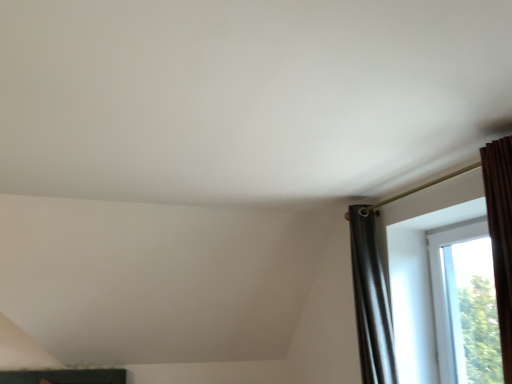
Image resolution: width=512 pixels, height=384 pixels. What do you see at coordinates (423, 269) in the screenshot?
I see `transparent glass window at right, which ranks as the 2th window in right-to-left order` at bounding box center [423, 269].

In order to face transparent glass window at right, which ranks as the 2th window in right-to-left order, should I rotate leftwards or rightwards?

To face it directly, rotate right by 22.806 degrees.

Where is `transparent glass window at right, which appears as the 1th window when viewed from the left`? transparent glass window at right, which appears as the 1th window when viewed from the left is located at coordinates (423, 269).

Measure the distance between transparent glass window at right, the 2th window in the left-to-right sequence, and camera.

transparent glass window at right, the 2th window in the left-to-right sequence, and camera are 8.05 feet apart from each other.

The image size is (512, 384). What do you see at coordinates (465, 304) in the screenshot?
I see `transparent glass window at right, the 2th window in the left-to-right sequence` at bounding box center [465, 304].

Locate an element on the screen. transparent glass window at right, the 2th window in the left-to-right sequence is located at coordinates (465, 304).

Where is `transparent glass window at right, which ranks as the 2th window in right-to-left order`? This screenshot has height=384, width=512. transparent glass window at right, which ranks as the 2th window in right-to-left order is located at coordinates (423, 269).

Does transparent glass window at right, the 2th window in the left-to-right sequence, appear on the left side of transparent glass window at right, which appears as the 1th window when viewed from the left?

Incorrect, transparent glass window at right, the 2th window in the left-to-right sequence, is not on the left side of transparent glass window at right, which appears as the 1th window when viewed from the left.

Is transparent glass window at right, the 1th window when ordered from right to left, further to the viewer compared to transparent glass window at right, which ranks as the 2th window in right-to-left order?

Yes, transparent glass window at right, the 1th window when ordered from right to left, is behind transparent glass window at right, which ranks as the 2th window in right-to-left order.

Between point (463, 380) and point (437, 346), which one is positioned behind?

The point (437, 346) is more distant.

From the image's perspective, is transparent glass window at right, the 2th window in the left-to-right sequence, on transparent glass window at right, which ranks as the 2th window in right-to-left order?

Actually, transparent glass window at right, the 2th window in the left-to-right sequence, appears below transparent glass window at right, which ranks as the 2th window in right-to-left order, in the image.

From a real-world perspective, is transparent glass window at right, the 2th window in the left-to-right sequence, beneath transparent glass window at right, which ranks as the 2th window in right-to-left order?

Yes.

Which object is thinner, transparent glass window at right, the 1th window when ordered from right to left, or transparent glass window at right, which appears as the 1th window when viewed from the left?

transparent glass window at right, which appears as the 1th window when viewed from the left, is thinner.

Does transparent glass window at right, the 2th window in the left-to-right sequence, have a lesser height compared to transparent glass window at right, which appears as the 1th window when viewed from the left?

Yes, transparent glass window at right, the 2th window in the left-to-right sequence, is shorter than transparent glass window at right, which appears as the 1th window when viewed from the left.

In terms of size, does transparent glass window at right, the 2th window in the left-to-right sequence, appear bigger or smaller than transparent glass window at right, which appears as the 1th window when viewed from the left?

Considering their sizes, transparent glass window at right, the 2th window in the left-to-right sequence, takes up less space than transparent glass window at right, which appears as the 1th window when viewed from the left.

In the scene shown: Is transparent glass window at right, the 2th window in the left-to-right sequence, not within transparent glass window at right, which ranks as the 2th window in right-to-left order?

Yes, transparent glass window at right, the 2th window in the left-to-right sequence, is outside of transparent glass window at right, which ranks as the 2th window in right-to-left order.

Based on the photo, would you consider transparent glass window at right, the 1th window when ordered from right to left, to be distant from transparent glass window at right, which ranks as the 2th window in right-to-left order?

Actually, transparent glass window at right, the 1th window when ordered from right to left, and transparent glass window at right, which ranks as the 2th window in right-to-left order, are a little close together.

Is transparent glass window at right, the 1th window when ordered from right to left, oriented away from transparent glass window at right, which appears as the 1th window when viewed from the left?

That's right, transparent glass window at right, the 1th window when ordered from right to left, is facing away from transparent glass window at right, which appears as the 1th window when viewed from the left.

What's the angular difference between transparent glass window at right, the 2th window in the left-to-right sequence, and transparent glass window at right, which ranks as the 2th window in right-to-left order,'s facing directions?

transparent glass window at right, the 2th window in the left-to-right sequence, and transparent glass window at right, which ranks as the 2th window in right-to-left order, are facing 0.394 degrees away from each other.

Locate an element on the screen. This screenshot has width=512, height=384. window behind the transparent glass window at right, which ranks as the 2th window in right-to-left order is located at coordinates (465, 304).

Is transparent glass window at right, which appears as the 1th window when viewed from the left, to the left of transparent glass window at right, the 2th window in the left-to-right sequence, from the viewer's perspective?

Yes.

Is transparent glass window at right, which ranks as the 2th window in right-to-left order, positioned before transparent glass window at right, the 2th window in the left-to-right sequence?

Yes, it is in front of transparent glass window at right, the 2th window in the left-to-right sequence.

Is point (411, 262) positioned after point (451, 381)?

That is True.

From the image's perspective, is transparent glass window at right, which ranks as the 2th window in right-to-left order, below transparent glass window at right, the 2th window in the left-to-right sequence?

No.

From a real-world perspective, does transparent glass window at right, which ranks as the 2th window in right-to-left order, stand above transparent glass window at right, the 2th window in the left-to-right sequence?

Yes, from a real-world perspective, transparent glass window at right, which ranks as the 2th window in right-to-left order, is over transparent glass window at right, the 2th window in the left-to-right sequence

Looking at their sizes, would you say transparent glass window at right, which ranks as the 2th window in right-to-left order, is wider or thinner than transparent glass window at right, the 2th window in the left-to-right sequence?

transparent glass window at right, which ranks as the 2th window in right-to-left order, is thinner than transparent glass window at right, the 2th window in the left-to-right sequence.

Can you confirm if transparent glass window at right, which appears as the 1th window when viewed from the left, is taller than transparent glass window at right, the 1th window when ordered from right to left?

Indeed, transparent glass window at right, which appears as the 1th window when viewed from the left, has a greater height compared to transparent glass window at right, the 1th window when ordered from right to left.

Between transparent glass window at right, which ranks as the 2th window in right-to-left order, and transparent glass window at right, the 1th window when ordered from right to left, which one has smaller size?

With smaller size is transparent glass window at right, the 1th window when ordered from right to left.

Is transparent glass window at right, which appears as the 1th window when viewed from the left, positioned beyond the bounds of transparent glass window at right, the 1th window when ordered from right to left?

Absolutely, transparent glass window at right, which appears as the 1th window when viewed from the left, is external to transparent glass window at right, the 1th window when ordered from right to left.

Is transparent glass window at right, which appears as the 1th window when viewed from the left, in contact with transparent glass window at right, the 2th window in the left-to-right sequence?

There is a gap between transparent glass window at right, which appears as the 1th window when viewed from the left, and transparent glass window at right, the 2th window in the left-to-right sequence.

Does transparent glass window at right, which ranks as the 2th window in right-to-left order, turn towards transparent glass window at right, the 2th window in the left-to-right sequence?

Yes, transparent glass window at right, which ranks as the 2th window in right-to-left order, faces towards transparent glass window at right, the 2th window in the left-to-right sequence.

How different are the orientations of transparent glass window at right, which ranks as the 2th window in right-to-left order, and transparent glass window at right, the 2th window in the left-to-right sequence, in degrees?

They differ by 0.394 degrees in their facing directions.

What are the coordinates of `window above the transparent glass window at right, the 1th window when ordered from right to left (from a real-world perspective)` in the screenshot? It's located at (423, 269).

Find the location of a particular element. window in front of the transparent glass window at right, the 2th window in the left-to-right sequence is located at coordinates (423, 269).

Where is `window that appears behind the transparent glass window at right, which appears as the 1th window when viewed from the left`? The image size is (512, 384). window that appears behind the transparent glass window at right, which appears as the 1th window when viewed from the left is located at coordinates (465, 304).